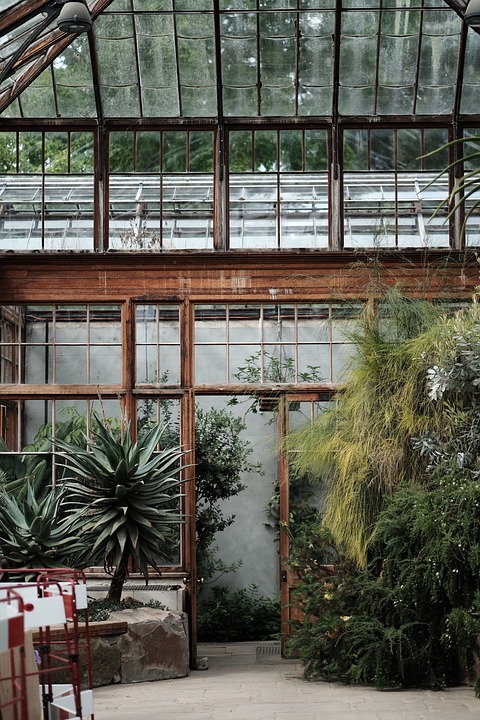
This screenshot has width=480, height=720. In order to click on middle window pane in this screenshot , I will do `click(102, 168)`, `click(337, 188)`, `click(230, 341)`, `click(61, 341)`.